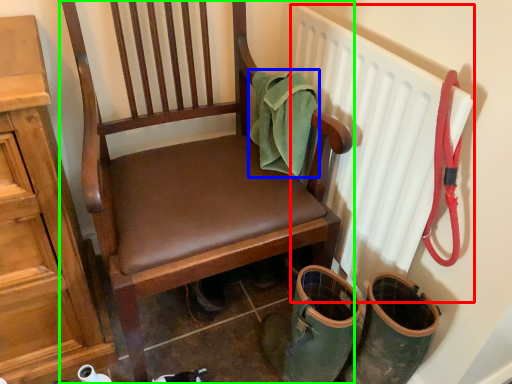
Question: Based on their relative distances, which object is farther from radiator (highlighted by a red box)? Choose from material (highlighted by a blue box) and chair (highlighted by a green box).

Choices:
 (A) material
 (B) chair

Answer: (B)